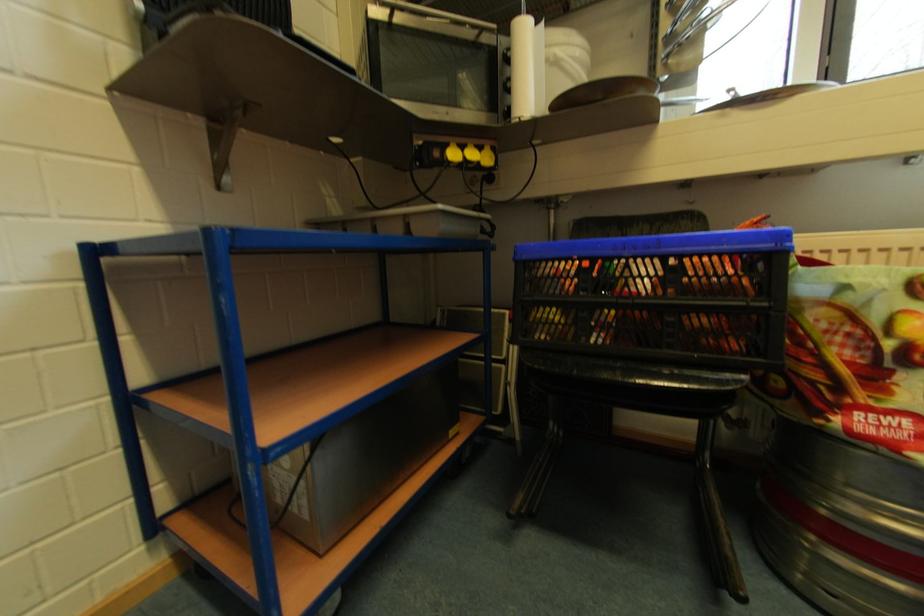
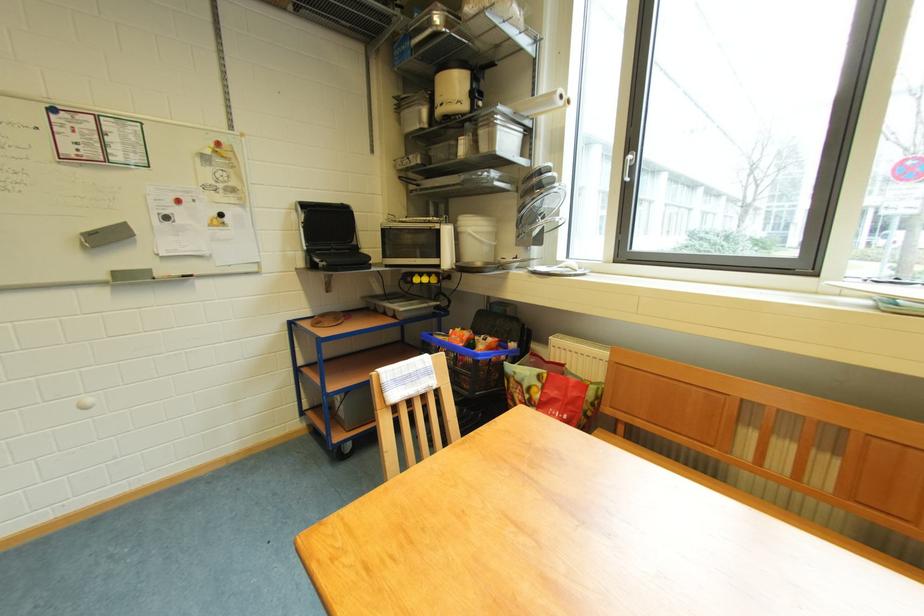
Where in the second image is the point corresponding to pixel 480 156 from the first image?

(432, 283)